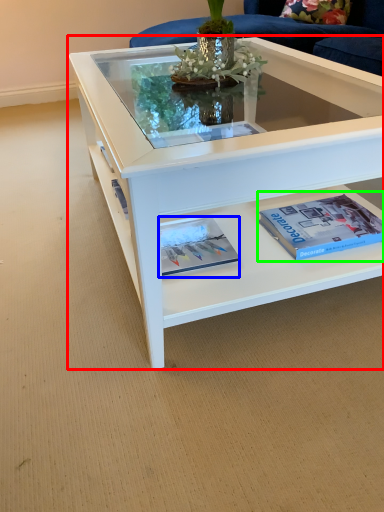
Question: Which is farther away from coffee table (highlighted by a red box)? magazine (highlighted by a blue box) or paperback book (highlighted by a green box)?

Choices:
 (A) magazine
 (B) paperback book

Answer: (A)